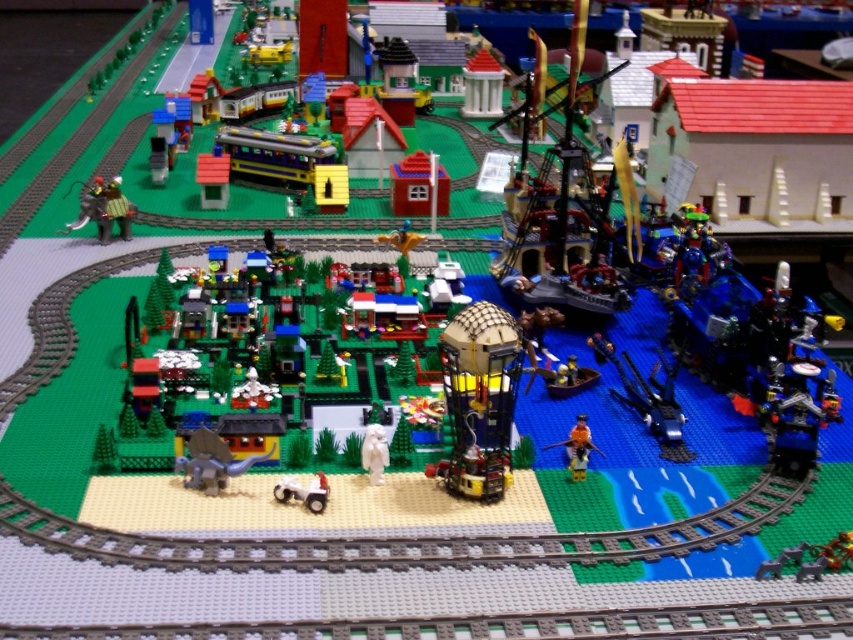
Consider the image. Is translucent yellow/golden metallic sphere at center positioned in front of orange matte figure at center?

Yes.

Is point (491, 456) behind point (573, 468)?

No, it is not.

Identify the location of translucent yellow/golden metallic sphere at center. (479, 400).

Which of these two, smooth gray dinosaur at center or white matte car at center, stands shorter?

With less height is white matte car at center.

Is point (199, 472) farther from camera compared to point (283, 488)?

Yes, point (199, 472) is behind point (283, 488).

What do you see at coordinates (212, 461) in the screenshot? I see `smooth gray dinosaur at center` at bounding box center [212, 461].

Image resolution: width=853 pixels, height=640 pixels. I want to click on smooth gray dinosaur at center, so click(x=212, y=461).

Can you confirm if smooth gray dinosaur at center is positioned to the left of orange matte figure at center?

Indeed, smooth gray dinosaur at center is positioned on the left side of orange matte figure at center.

Is smooth gray dinosaur at center bigger than orange matte figure at center?

Yes.

This screenshot has height=640, width=853. Describe the element at coordinates (212, 461) in the screenshot. I see `smooth gray dinosaur at center` at that location.

This screenshot has width=853, height=640. Find the location of `smooth gray dinosaur at center`. smooth gray dinosaur at center is located at coordinates (212, 461).